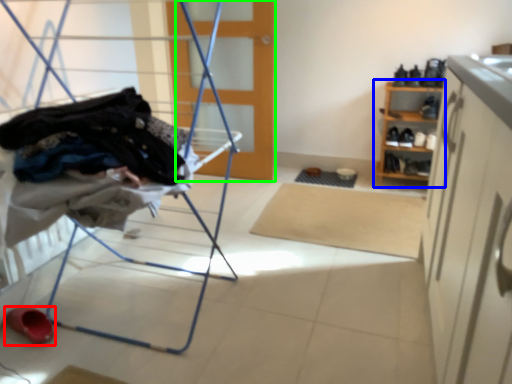
Question: Based on their relative distances, which object is farther from footwear (highlighted by a red box)? Choose from shelf (highlighted by a blue box) and door (highlighted by a green box).

Choices:
 (A) shelf
 (B) door

Answer: (A)